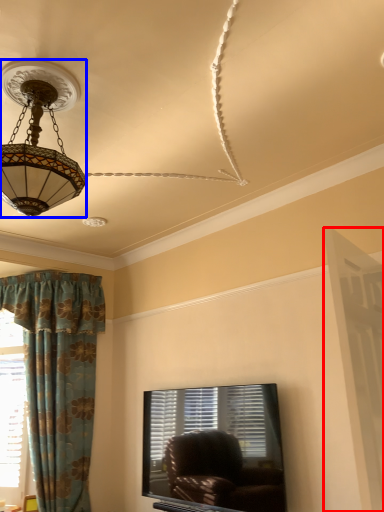
Question: Which of the following is the farthest to the observer, screen door (highlighted by a red box) or lamp (highlighted by a blue box)?

Choices:
 (A) screen door
 (B) lamp

Answer: (B)